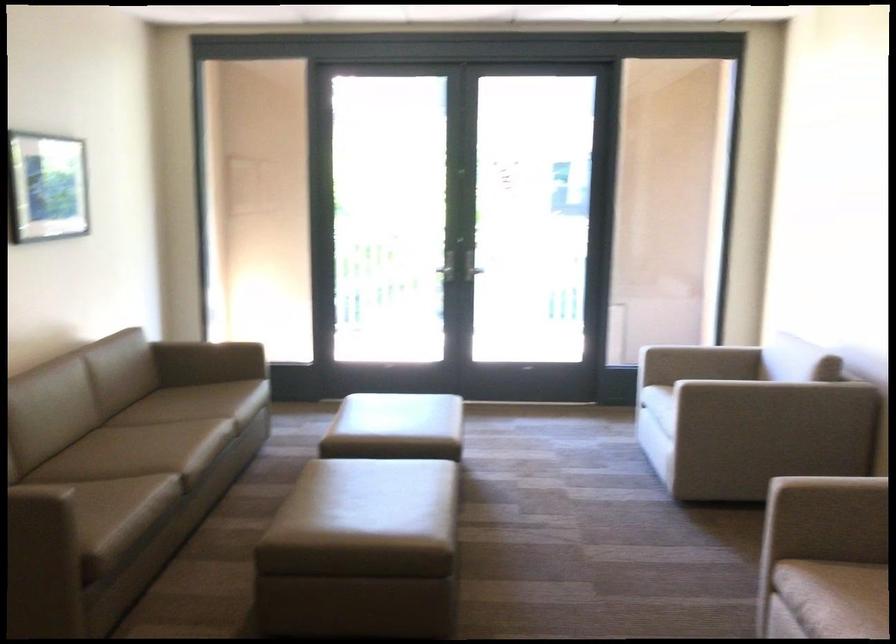
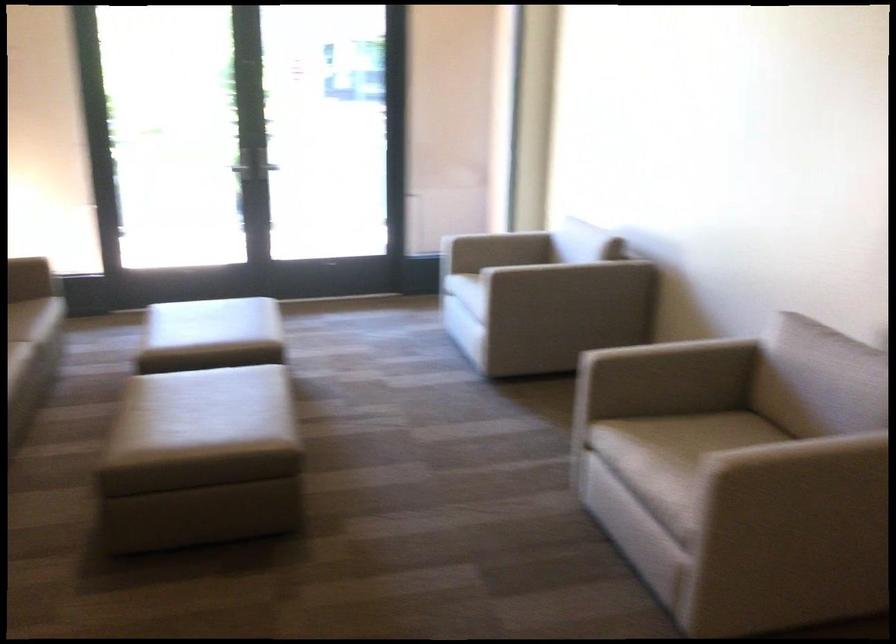
Question: The first image is from the beginning of the video and the second image is from the end. How did the camera likely rotate when shooting the video?

Choices:
 (A) Left
 (B) Right
 (C) Up
 (D) Down

Answer: (B)